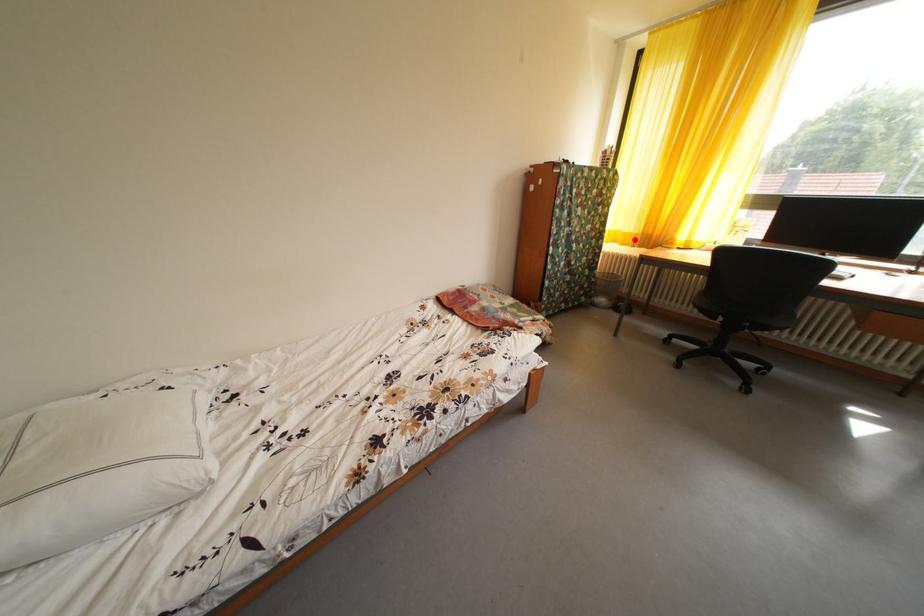
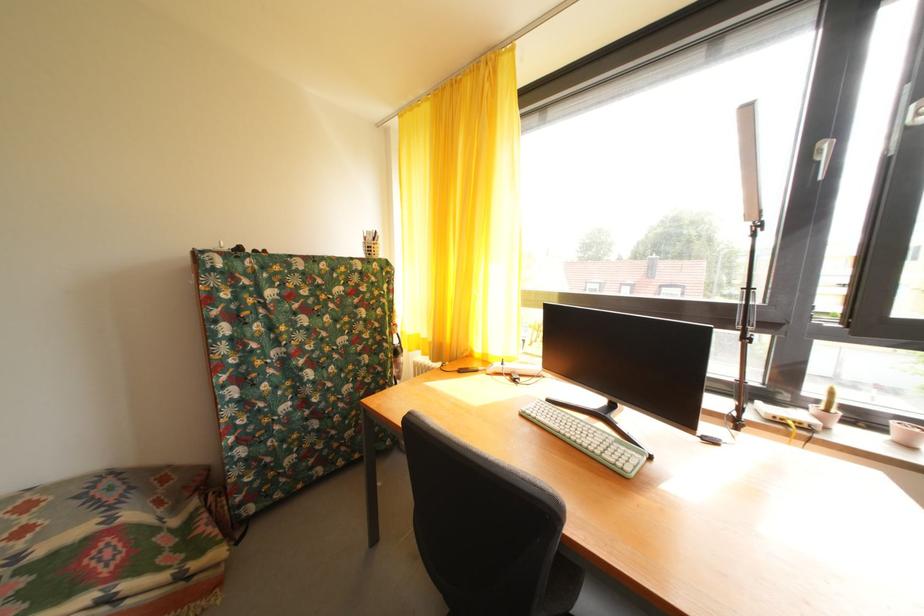
In the second image, find the point that corresponds to the highlighted location in the first image.

(432, 346)